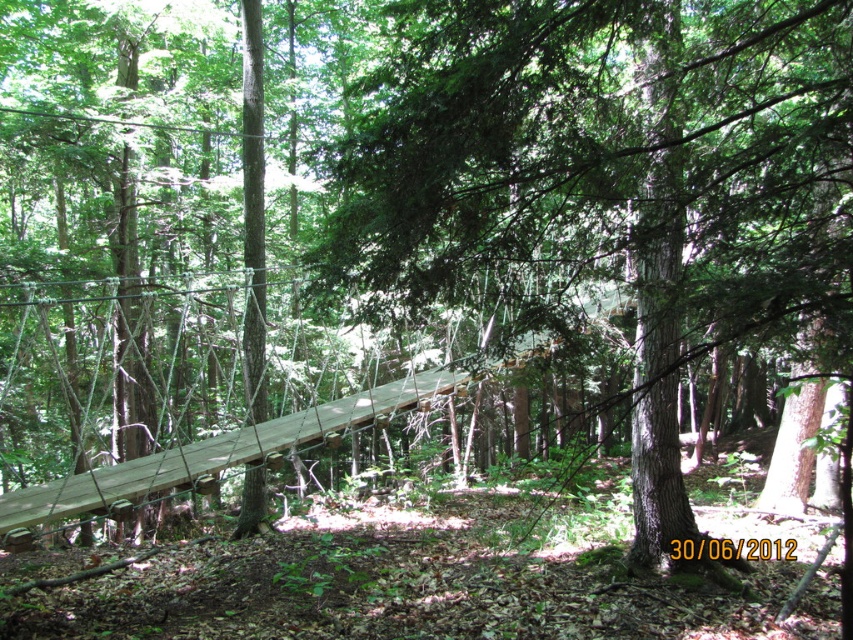
Between brown wood bridge at center and wooden plank bridge at center, which one appears on the left side from the viewer's perspective?

wooden plank bridge at center is more to the left.

Is point (537, 28) farther from viewer compared to point (90, 483)?

No, (537, 28) is closer to viewer.

Locate an element on the screen. The image size is (853, 640). brown wood bridge at center is located at coordinates (611, 179).